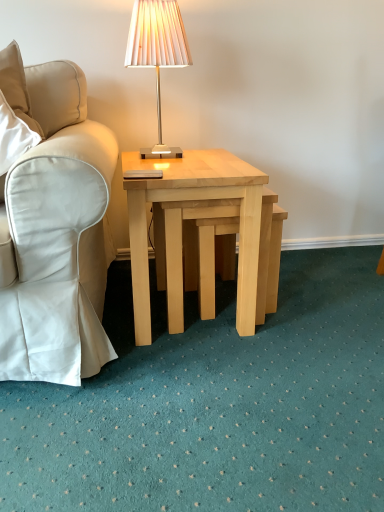
This screenshot has width=384, height=512. I want to click on vacant area on top of light wood/natural wood coffee table at center (from a real-world perspective), so click(191, 160).